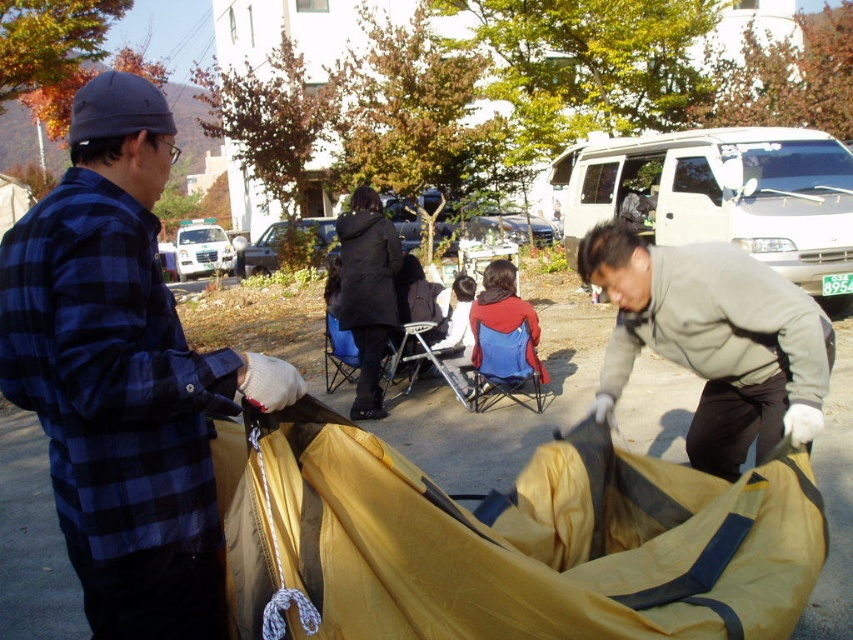
Question: Which of these objects is positioned farthest from the blue fabric baby carriage at center?

Choices:
 (A) red fleece jacket at center
 (B) blue plaid shirt at left

Answer: (A)

Question: Among these points, which one is nearest to the camera?

Choices:
 (A) (103, 435)
 (B) (283, 596)

Answer: (A)

Question: Does gray fleece jacket at lower right have a lesser width compared to red fleece jacket at center?

Choices:
 (A) yes
 (B) no

Answer: (B)

Question: Which of the following is the closest to the observer?

Choices:
 (A) (x=397, y=260)
 (B) (x=656, y=273)
 (C) (x=624, y=529)

Answer: (B)

Question: Is blue fabric baby carriage at center thinner than red fleece jacket at center?

Choices:
 (A) yes
 (B) no

Answer: (B)

Question: Can you confirm if blue fabric baby carriage at center is thinner than black matte coat at center?

Choices:
 (A) yes
 (B) no

Answer: (B)